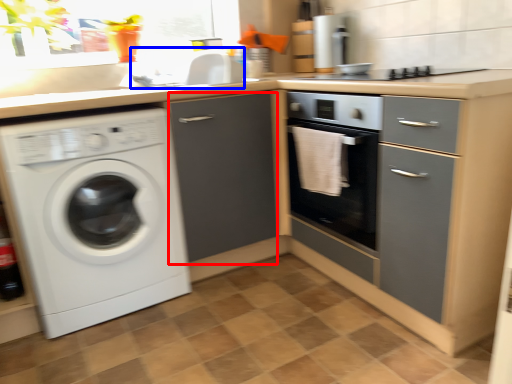
Question: Which object appears closest to the camera in this image, file cabinet (highlighted by a red box) or sink (highlighted by a blue box)?

Choices:
 (A) file cabinet
 (B) sink

Answer: (A)